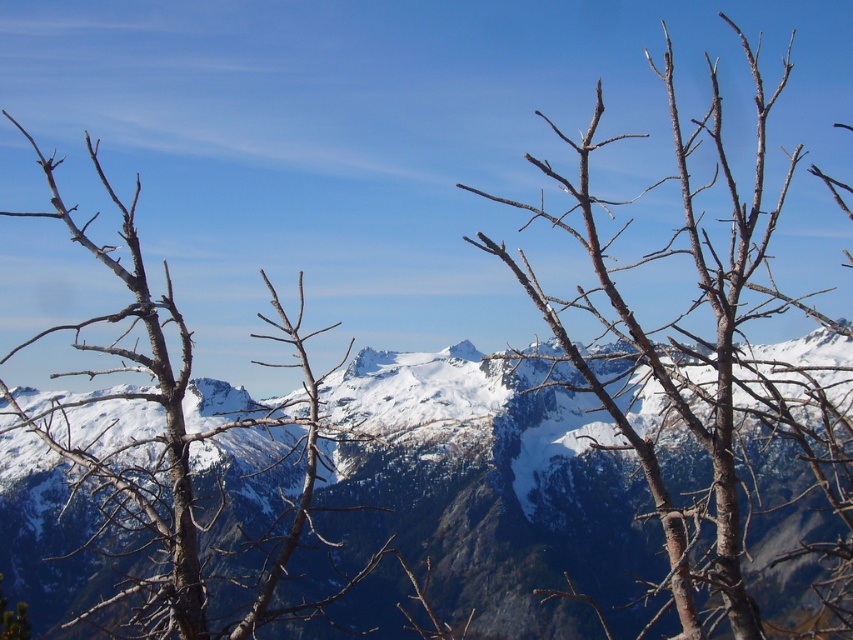
Question: Is brown/dry wood branches at center thinner than brown/dry wood tree at center?

Choices:
 (A) yes
 (B) no

Answer: (B)

Question: Is the position of snowy rock mountain range at center less distant than that of brown/dry wood tree at center?

Choices:
 (A) no
 (B) yes

Answer: (A)

Question: Is snowy rock mountain range at center bigger than brown/dry wood branches at center?

Choices:
 (A) no
 (B) yes

Answer: (A)

Question: Which object is farther from the camera taking this photo?

Choices:
 (A) brown/dry wood branches at center
 (B) brown/dry wood tree at center

Answer: (B)

Question: Which is farther from the brown/dry wood branches at center?

Choices:
 (A) brown/dry wood tree at center
 (B) snowy rock mountain range at center

Answer: (A)

Question: Which is nearer to the brown/dry wood branches at center?

Choices:
 (A) snowy rock mountain range at center
 (B) brown/dry wood tree at center

Answer: (A)